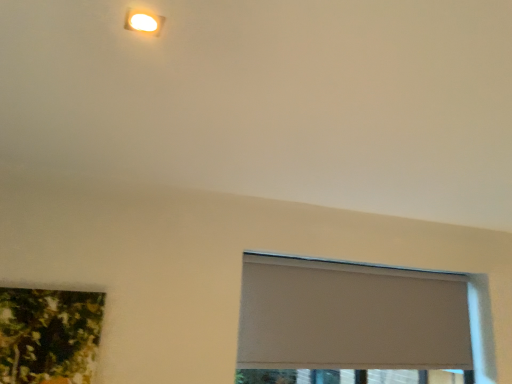
You are a GUI agent. You are given a task and a screenshot of the screen. Output one action in this format:
    pyautogui.click(x=<x>, y=<y>)
    Task: Click on the white matte window at center
    The image size is (512, 384).
    Given the screenshot: What is the action you would take?
    pyautogui.click(x=350, y=316)

This screenshot has height=384, width=512. What do you see at coordinates (350, 316) in the screenshot? I see `white matte window at center` at bounding box center [350, 316].

The height and width of the screenshot is (384, 512). What are the coordinates of `white matte window at center` in the screenshot? It's located at (350, 316).